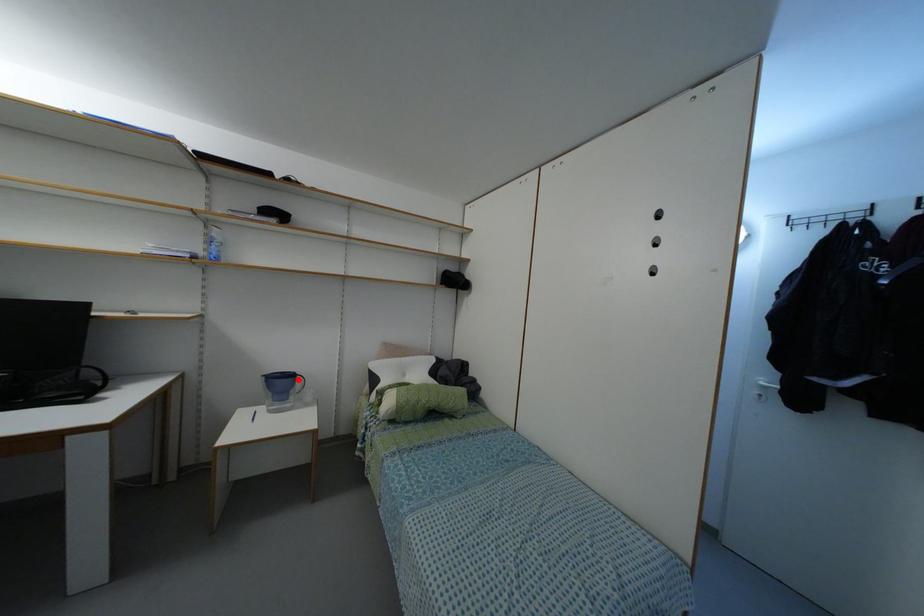
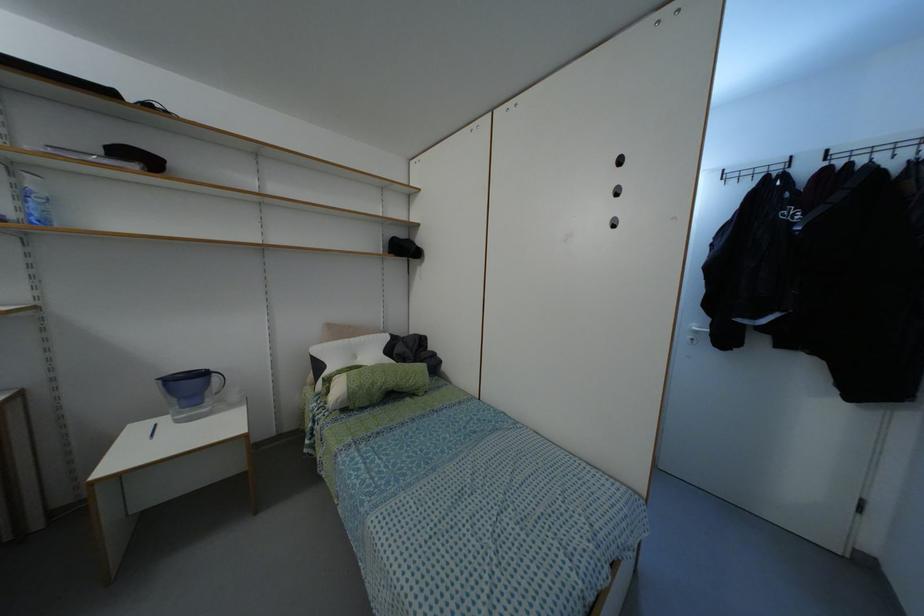
Where in the second image is the point corresponding to the highlighted location from the first image?

(214, 378)